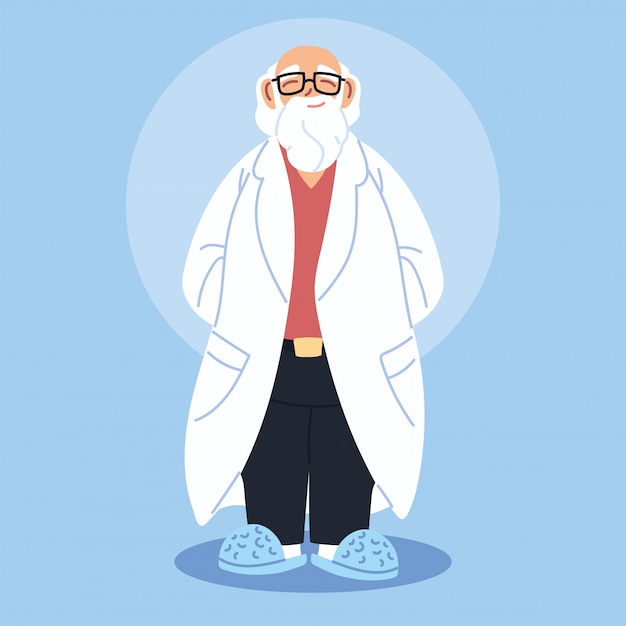
This screenshot has height=626, width=626. Find the location of `blue slippers`. blue slippers is located at coordinates (364, 558), (260, 548).